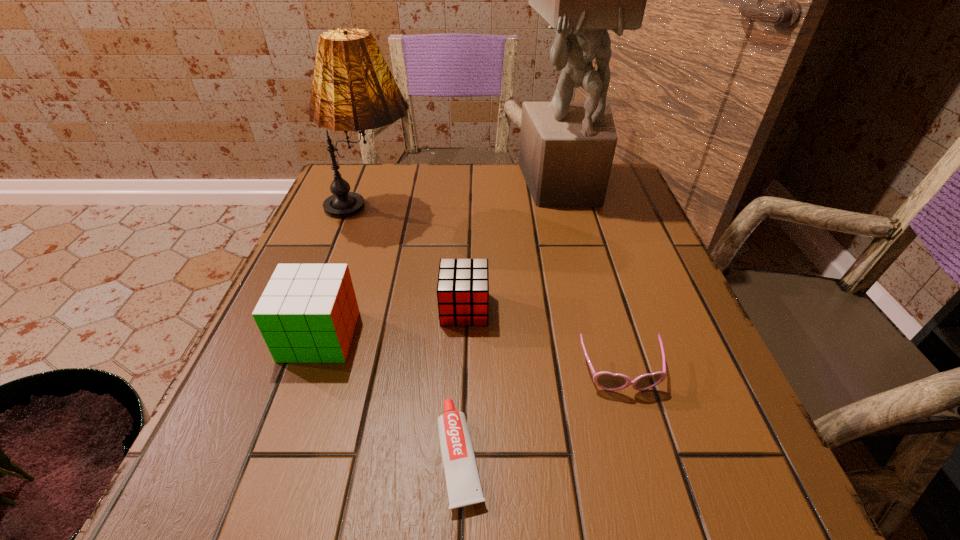
Identify the location of the tallest object. The width and height of the screenshot is (960, 540). (566, 152).

Locate an element on the screen. Image resolution: width=960 pixels, height=540 pixels. lampshade is located at coordinates (353, 89).

This screenshot has width=960, height=540. Identify the location of the taller cube. (307, 313).

This screenshot has width=960, height=540. In order to click on the fourth shortest object in this screenshot , I will do `click(307, 313)`.

Find the location of `the right cube`. the right cube is located at coordinates (463, 284).

This screenshot has width=960, height=540. Find the location of `the shorter cube`. the shorter cube is located at coordinates (463, 284).

This screenshot has width=960, height=540. Identify the location of the fifth tallest object. (608, 381).

Where is `toothpaste`? The height and width of the screenshot is (540, 960). toothpaste is located at coordinates (463, 483).

The height and width of the screenshot is (540, 960). In order to click on the shortest object in this screenshot , I will do `click(463, 483)`.

The width and height of the screenshot is (960, 540). Find the location of `vacant position located on the front-facing side of the tallest object`. vacant position located on the front-facing side of the tallest object is located at coordinates (605, 334).